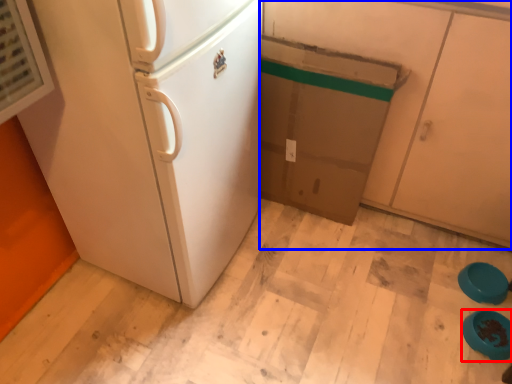
Question: Which object appears closest to the camera in this image, appliance (highlighted by a red box) or cabinetry (highlighted by a blue box)?

Choices:
 (A) appliance
 (B) cabinetry

Answer: (B)